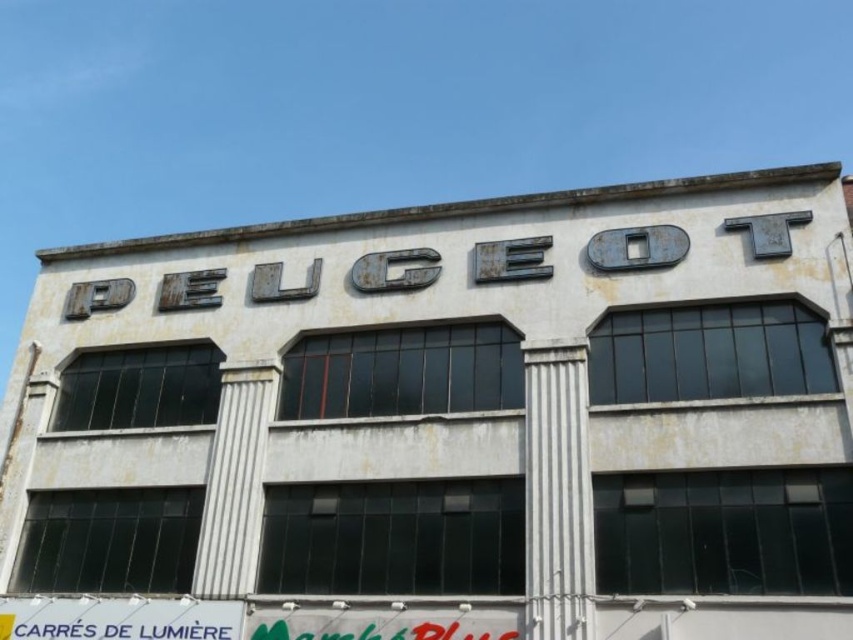
Between point (419, 554) and point (90, 600), which one is positioned in front?

Point (419, 554) is in front.

Between point (62, 257) and point (107, 621), which one is positioned in front?

Point (107, 621) is in front.

This screenshot has height=640, width=853. I want to click on white faded sign at center, so click(x=453, y=417).